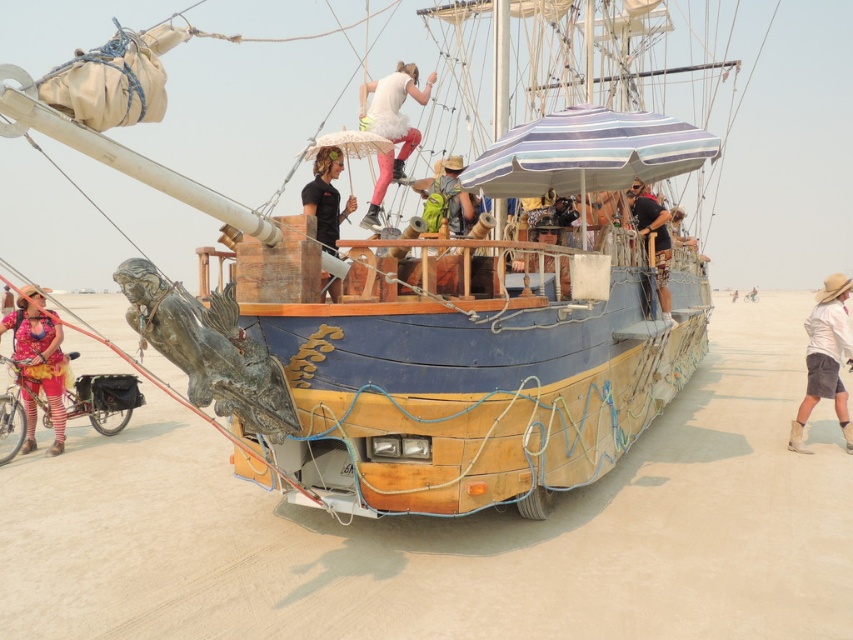
Consider the image. Is floral fabric dress at lower left to the left of white cotton shirt at right from the viewer's perspective?

Yes, floral fabric dress at lower left is to the left of white cotton shirt at right.

Is point (28, 410) in front of point (849, 429)?

Yes.

This screenshot has width=853, height=640. Identify the location of floral fabric dress at lower left. (38, 362).

Identify the location of white fluffy tutu at upper center. The image size is (853, 640). (390, 128).

Is white fluffy tutu at upper center shorter than matte black shirt at upper center?

Indeed, white fluffy tutu at upper center has a lesser height compared to matte black shirt at upper center.

Locate an element on the screen. white fluffy tutu at upper center is located at coordinates (390, 128).

Who is positioned more to the left, white cotton shirt at right or white fluffy tutu at upper center?

Positioned to the left is white fluffy tutu at upper center.

Does white cotton shirt at right have a lesser height compared to white fluffy tutu at upper center?

Indeed, white cotton shirt at right has a lesser height compared to white fluffy tutu at upper center.

Is point (836, 300) less distant than point (403, 166)?

Yes, point (836, 300) is in front of point (403, 166).

This screenshot has width=853, height=640. Find the location of `white cotton shirt at right`. white cotton shirt at right is located at coordinates (825, 358).